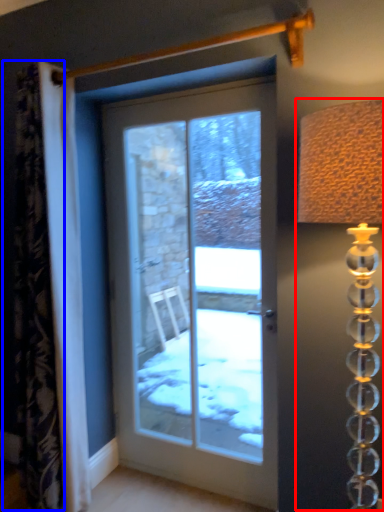
Question: Which object is further to the camera taking this photo, table lamp (highlighted by a red box) or curtain (highlighted by a blue box)?

Choices:
 (A) table lamp
 (B) curtain

Answer: (B)